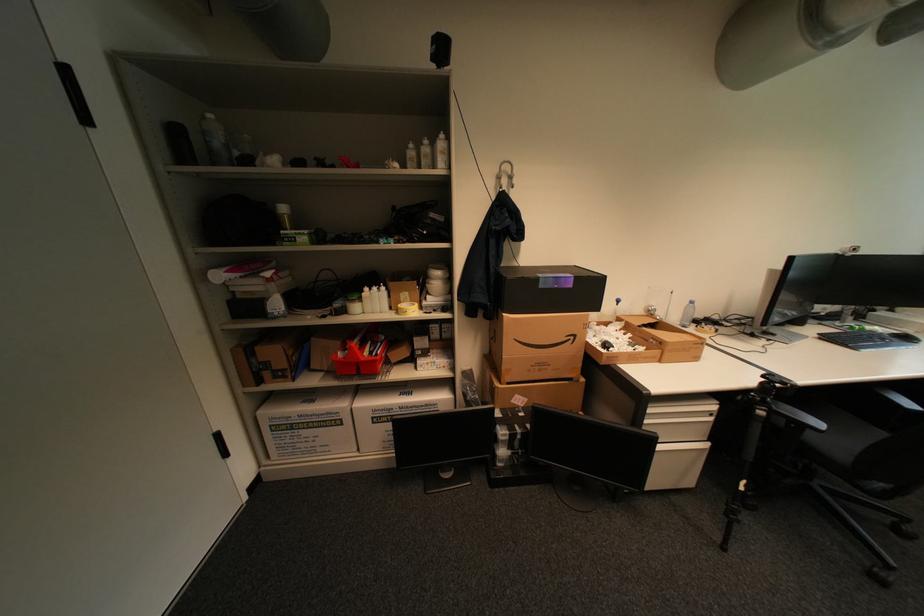
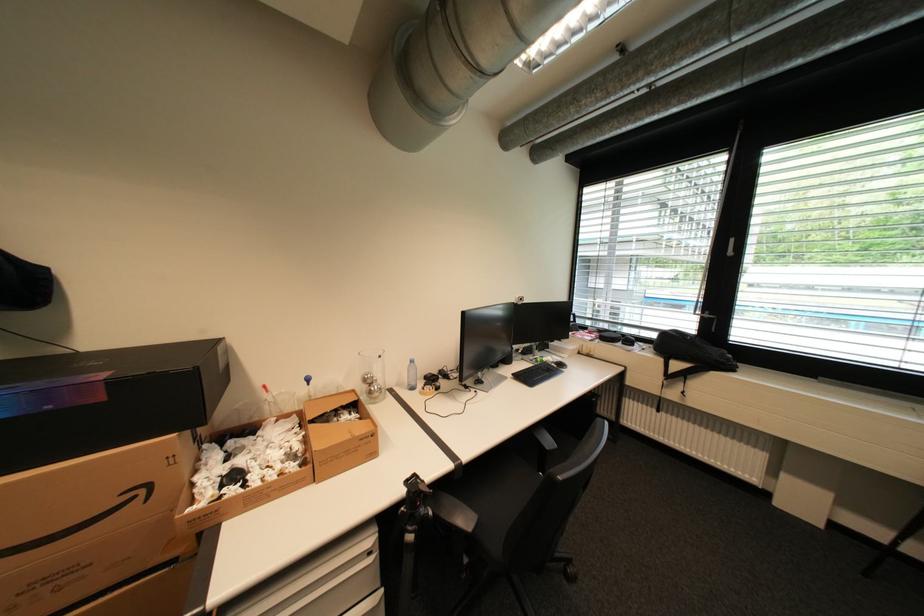
The point at (772,377) is marked in the first image. Where is the corresponding point in the second image?

(416, 484)